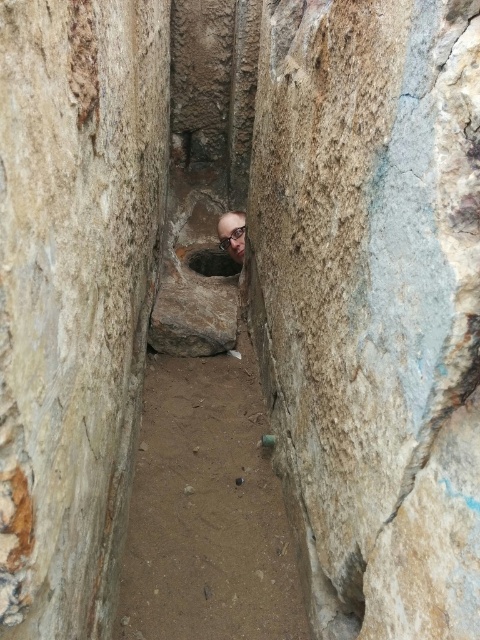
Which is more to the left, rough stone wall at center or smooth stone hole at center?

Positioned to the left is smooth stone hole at center.

Measure the distance between rough stone wall at center and camera.

The distance of rough stone wall at center from camera is 34.09 inches.

Find the location of a particular element. rough stone wall at center is located at coordinates (372, 304).

Who is lower down, smooth stone hole at center or smooth bald head at center?

Positioned lower is smooth stone hole at center.

Is point (224, 253) in front of point (219, 216)?

Yes, it is in front of point (219, 216).

I want to click on smooth stone hole at center, so click(x=213, y=262).

Is rough stone wall at center closer to the viewer compared to smooth bald head at center?

Yes, it is in front of smooth bald head at center.

Can you confirm if rough stone wall at center is positioned above smooth bald head at center?

No, rough stone wall at center is not above smooth bald head at center.

At what (x,y) coordinates should I click in order to perform the action: click on rough stone wall at center. Please return your answer as a coordinate pair (x, y). The height and width of the screenshot is (640, 480). Looking at the image, I should click on (372, 304).